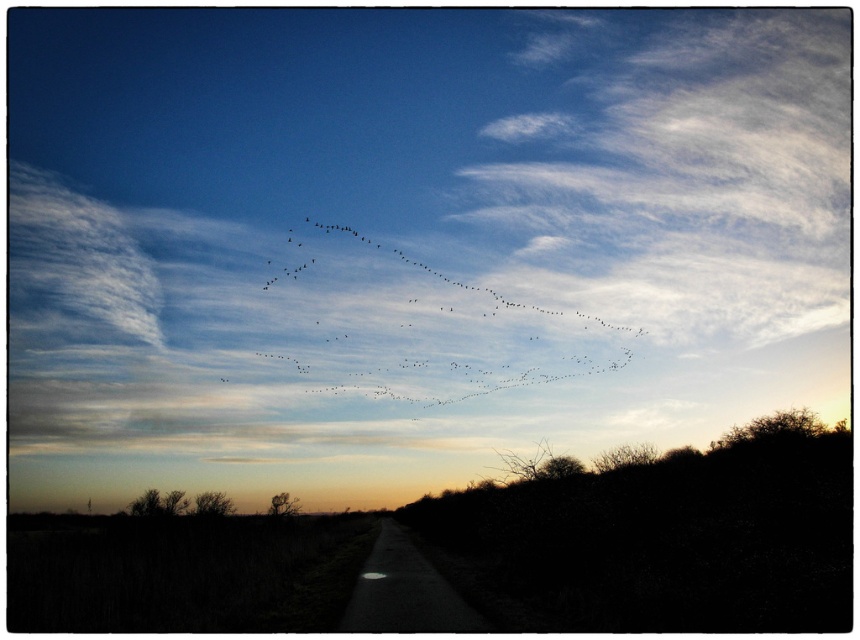
Question: Among these objects, which one is nearest to the camera?

Choices:
 (A) white fluffy cloud at upper center
 (B) black matte birds at upper center

Answer: (B)

Question: Can you confirm if white fluffy cloud at upper center is positioned below black matte birds at upper center?

Choices:
 (A) no
 (B) yes

Answer: (A)

Question: Can you confirm if white fluffy cloud at upper center is smaller than black matte birds at upper center?

Choices:
 (A) no
 (B) yes

Answer: (A)

Question: Among these points, which one is farthest from the camera?

Choices:
 (A) (617, 358)
 (B) (697, 307)

Answer: (B)

Question: Is white fluffy cloud at upper center below black matte birds at upper center?

Choices:
 (A) no
 (B) yes

Answer: (A)